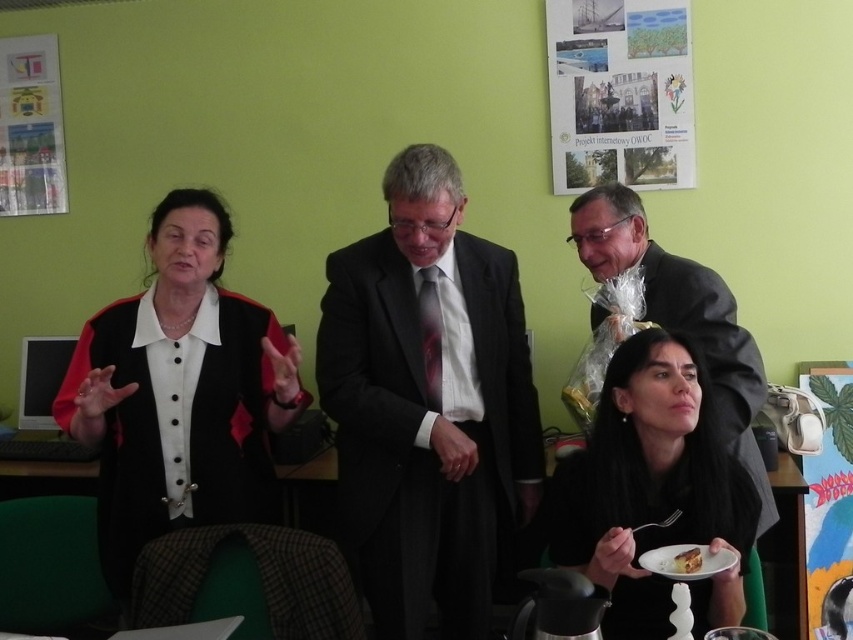
Does black velvet vest at left have a greater height compared to black matte hair at lower right?

Correct, black velvet vest at left is much taller as black matte hair at lower right.

Is black velvet vest at left shorter than black matte hair at lower right?

In fact, black velvet vest at left may be taller than black matte hair at lower right.

Is point (265, 390) more distant than point (630, 435)?

Yes.

You are a GUI agent. You are given a task and a screenshot of the screen. Output one action in this format:
    pyautogui.click(x=<x>, y=<y>)
    Task: Click on the black velvet vest at left
    
    Given the screenshot: What is the action you would take?
    pyautogui.click(x=178, y=392)

Between black velvet vest at left and white cake at lower right, which one is positioned lower?

white cake at lower right is below.

Is black velvet vest at left shorter than white cake at lower right?

No, black velvet vest at left is not shorter than white cake at lower right.

The width and height of the screenshot is (853, 640). I want to click on black velvet vest at left, so click(x=178, y=392).

I want to click on black velvet vest at left, so 178,392.

Does point (447, 506) come behind point (637, 381)?

Yes.

Between point (422, 625) and point (634, 493), which one is positioned in front?

Point (634, 493) is in front.

The height and width of the screenshot is (640, 853). I want to click on matte black suit at center, so click(x=428, y=403).